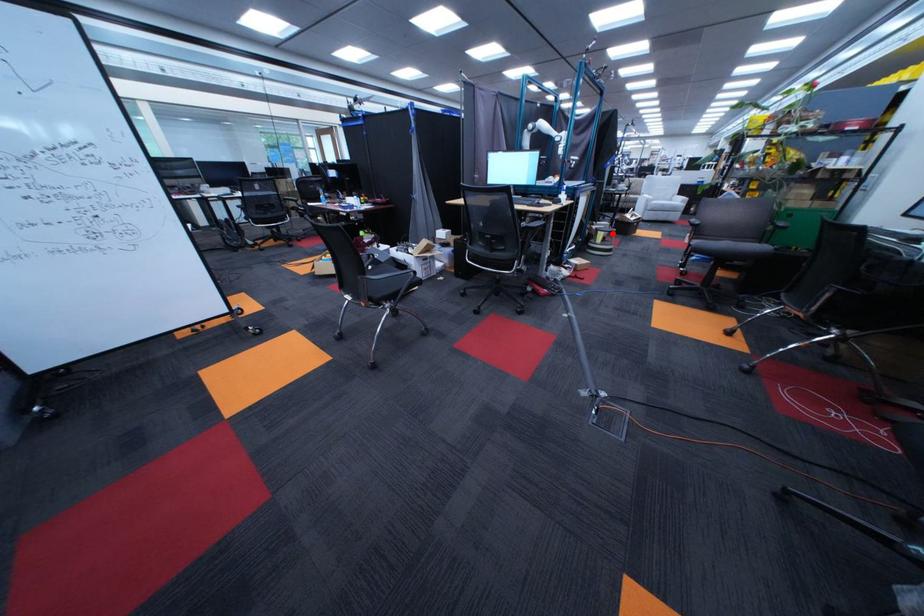
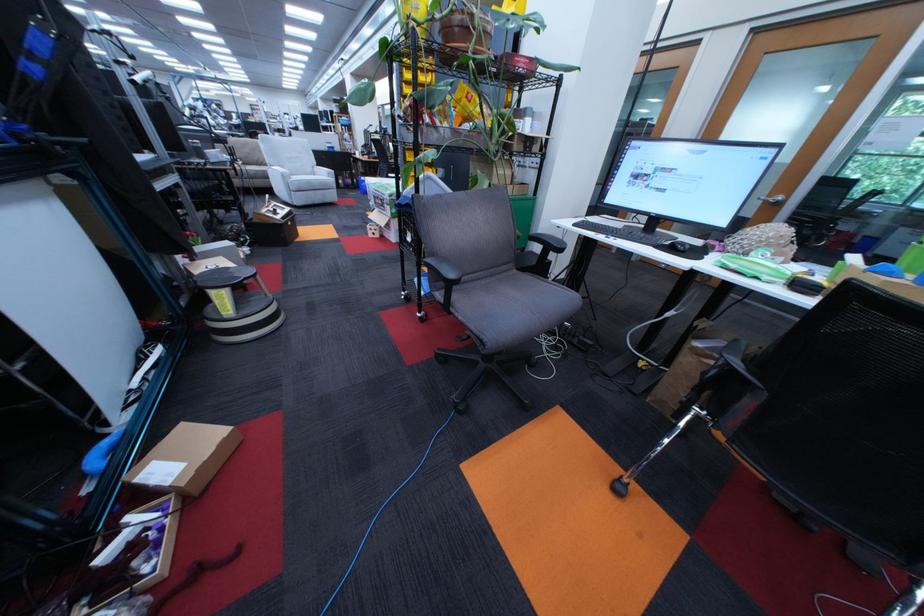
Find the pixel in the second image that matches the highlighted location in the first image.

(225, 294)